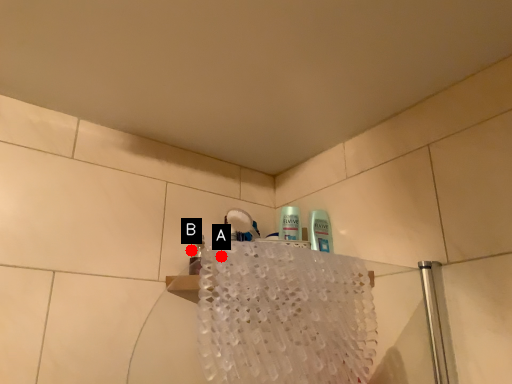
Question: Two points are circled on the image, labeled by A and B beside each circle. Which point is closer to the camera?

Choices:
 (A) A is closer
 (B) B is closer

Answer: (A)